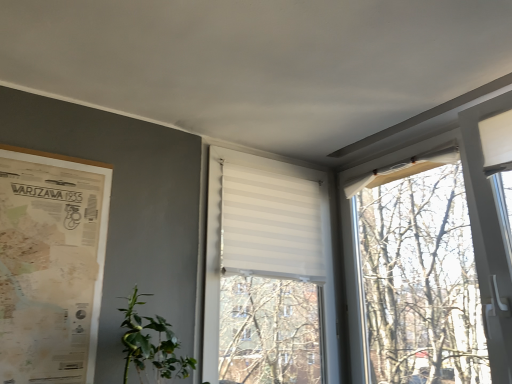
Question: Relative to white striped blind at center, is vintage paper map at left in front or behind?

Choices:
 (A) front
 (B) behind

Answer: (A)

Question: From the image's perspective, is vintage paper map at left positioned above or below white striped blind at center?

Choices:
 (A) below
 (B) above

Answer: (B)

Question: Estimate the real-world distances between objects in this image. Which object is farther from the vintage paper map at left?

Choices:
 (A) white striped blind at center
 (B) green leafy plant at lower left

Answer: (A)

Question: Based on their relative distances, which object is nearer to the vintage paper map at left?

Choices:
 (A) white striped blind at center
 (B) green leafy plant at lower left

Answer: (B)